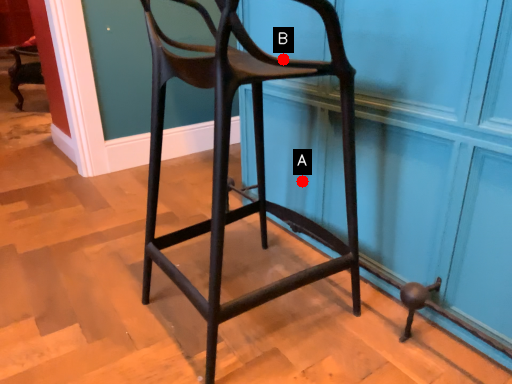
Question: Two points are circled on the image, labeled by A and B beside each circle. Which of the following is the closest to the observer?

Choices:
 (A) A is closer
 (B) B is closer

Answer: (B)